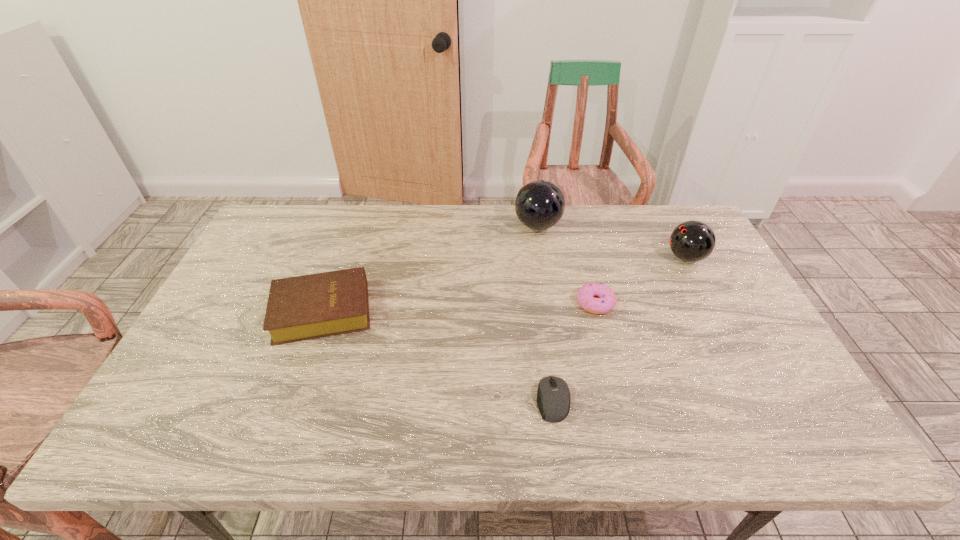
Image resolution: width=960 pixels, height=540 pixels. What are the coordinates of `vacant area in the image that satisfies the following two spatial constraints: 1. on the surface of the fourth shortest object near the finger holes; 2. on the front side of the computer equipment` in the screenshot? It's located at (760, 400).

This screenshot has width=960, height=540. I want to click on vacant space that satisfies the following two spatial constraints: 1. on the side of the doughnut with the finger holes; 2. on the left side of the tallest object, so click(550, 303).

The width and height of the screenshot is (960, 540). I want to click on free space that satisfies the following two spatial constraints: 1. on the side of the tallest object with the finger holes; 2. on the front side of the shortest object, so click(565, 400).

In order to click on blank space that satisfies the following two spatial constraints: 1. on the back side of the shortest object; 2. on the left side of the doughnut in this screenshot , I will do `click(540, 303)`.

In order to click on vacant region that satisfies the following two spatial constraints: 1. on the surface of the fourth nearest object near the finger holes; 2. on the front side of the Bible in this screenshot , I will do `click(714, 311)`.